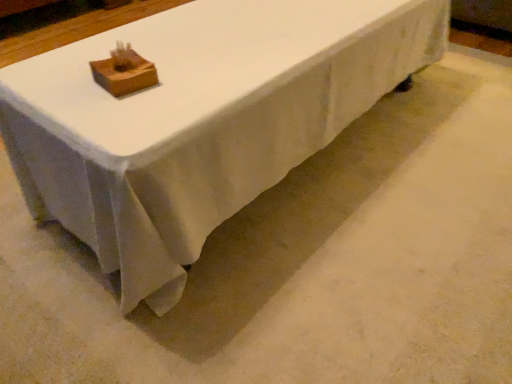
Image resolution: width=512 pixels, height=384 pixels. In order to click on wooden block at upper center in this screenshot , I will do `click(124, 72)`.

The image size is (512, 384). Describe the element at coordinates (124, 72) in the screenshot. I see `wooden block at upper center` at that location.

Describe the element at coordinates (199, 120) in the screenshot. I see `white fabric table at center` at that location.

Based on the photo, what is the approximate height of white fabric table at center?

white fabric table at center is 3.29 inches tall.

Locate an element on the screen. This screenshot has width=512, height=384. white fabric table at center is located at coordinates click(199, 120).

Locate an element on the screen. wooden block at upper center is located at coordinates (124, 72).

Between white fabric table at center and wooden block at upper center, which one appears on the right side from the viewer's perspective?

Positioned to the right is white fabric table at center.

In the image, is white fabric table at center positioned in front of or behind wooden block at upper center?

Visually, white fabric table at center is located in front of wooden block at upper center.

Which is closer, (x=75, y=159) or (x=114, y=52)?

Point (x=75, y=159) is positioned closer to the camera compared to point (x=114, y=52).

From the image's perspective, between white fabric table at center and wooden block at upper center, which one is located above?

white fabric table at center, from the image's perspective.

From a real-world perspective, is white fabric table at center physically located above or below wooden block at upper center?

In terms of real-world spatial position, white fabric table at center is below wooden block at upper center.

Is white fabric table at center wider or thinner than wooden block at upper center?

white fabric table at center is wider than wooden block at upper center.

In terms of height, does white fabric table at center look taller or shorter compared to wooden block at upper center?

white fabric table at center is taller than wooden block at upper center.

Does white fabric table at center have a larger size compared to wooden block at upper center?

Indeed, white fabric table at center has a larger size compared to wooden block at upper center.

Can wooden block at upper center be found inside white fabric table at center?

No, wooden block at upper center is not inside white fabric table at center.

Are white fabric table at center and wooden block at upper center located far from each other?

No, white fabric table at center is in close proximity to wooden block at upper center.

Is white fabric table at center looking in the opposite direction of wooden block at upper center?

No, white fabric table at center is not facing away from wooden block at upper center.

How many degrees apart are the facing directions of white fabric table at center and wooden block at upper center?

They differ by 95.7 degrees in their facing directions.

Measure the distance between white fabric table at center and wooden block at upper center.

white fabric table at center and wooden block at upper center are 14.00 inches apart from each other.

Find the location of a particular element. table that is under the wooden block at upper center (from a real-world perspective) is located at coordinates (199, 120).

Which is more to the left, wooden block at upper center or white fabric table at center?

Positioned to the left is wooden block at upper center.

Does wooden block at upper center lie behind white fabric table at center?

Yes, the depth of wooden block at upper center is greater than that of white fabric table at center.

Is point (130, 57) closer or farther from the camera than point (85, 171)?

Point (130, 57).

From the image's perspective, which is above, wooden block at upper center or white fabric table at center?

From the image's view, white fabric table at center is above.

From a real-world perspective, does wooden block at upper center stand above white fabric table at center?

Yes, from a real-world perspective, wooden block at upper center is over white fabric table at center

Between wooden block at upper center and white fabric table at center, which one has larger width?

Wider between the two is white fabric table at center.

Can you confirm if wooden block at upper center is taller than white fabric table at center?

Incorrect, the height of wooden block at upper center is not larger of that of white fabric table at center.

Does wooden block at upper center have a larger size compared to white fabric table at center?

No, wooden block at upper center is not bigger than white fabric table at center.

Is wooden block at upper center outside of white fabric table at center?

That's correct, wooden block at upper center is outside of white fabric table at center.

Are wooden block at upper center and white fabric table at center located far from each other?

Actually, wooden block at upper center and white fabric table at center are a little close together.

Is wooden block at upper center facing away from white fabric table at center?

No, wooden block at upper center's orientation is not away from white fabric table at center.

Can you tell me how much wooden block at upper center and white fabric table at center differ in facing direction?

There is a 95.7-degree angle between the facing directions of wooden block at upper center and white fabric table at center.

Measure the distance from wooden block at upper center to white fabric table at center.

A distance of 35.56 centimeters exists between wooden block at upper center and white fabric table at center.

The height and width of the screenshot is (384, 512). In the image, there is a wooden block at upper center. In order to click on table below it (from a real-world perspective) in this screenshot , I will do `click(199, 120)`.

Identify the location of block on the left of the white fabric table at center. (124, 72).

Locate an element on the screen. Image resolution: width=512 pixels, height=384 pixels. block that appears behind the white fabric table at center is located at coordinates (124, 72).